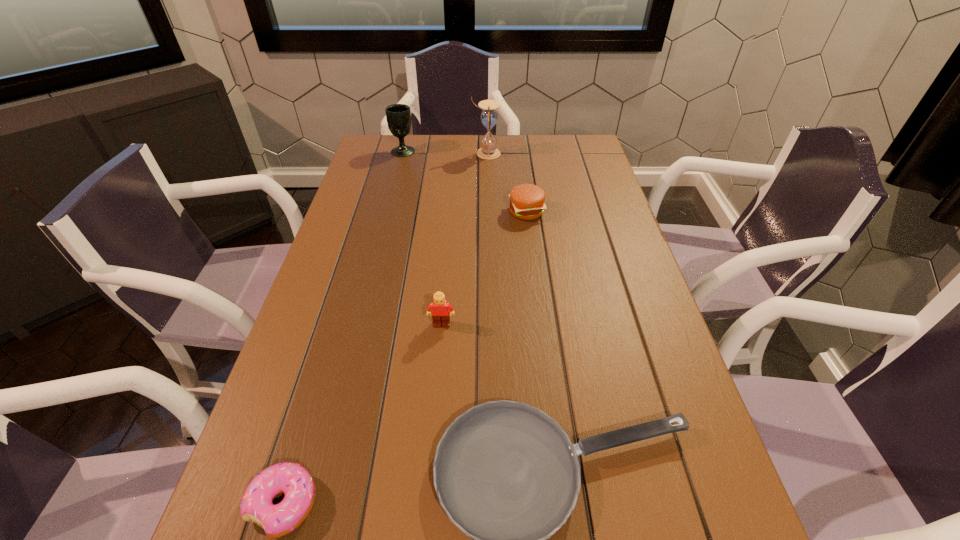
Image resolution: width=960 pixels, height=540 pixels. Find the location of `free space that is in between the second tallest object and the third nearest object`. free space that is in between the second tallest object and the third nearest object is located at coordinates (422, 238).

What are the coordinates of `free space that is in between the third farthest object and the second tallest object` in the screenshot? It's located at (465, 181).

Select which object appears as the second closest to the doughnut. Please provide its 2D coordinates. Your answer should be formatted as a tuple, i.e. [(x, y)], where the tuple contains the x and y coordinates of a point satisfying the conditions above.

[(440, 313)]

Identify which object is the third nearest to the fifth shortest object. Please provide its 2D coordinates. Your answer should be formatted as a tuple, i.e. [(x, y)], where the tuple contains the x and y coordinates of a point satisfying the conditions above.

[(440, 313)]

What are the coordinates of `vacant region that satisfies the following two spatial constraints: 1. on the front side of the third shortest object; 2. on the left side of the chalice` in the screenshot? It's located at (388, 212).